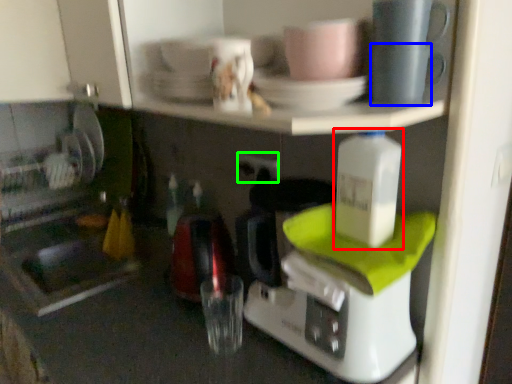
Question: Which is farther away from bottle (highlighted by a red box)? tableware (highlighted by a blue box) or electric outlet (highlighted by a green box)?

Choices:
 (A) tableware
 (B) electric outlet

Answer: (B)